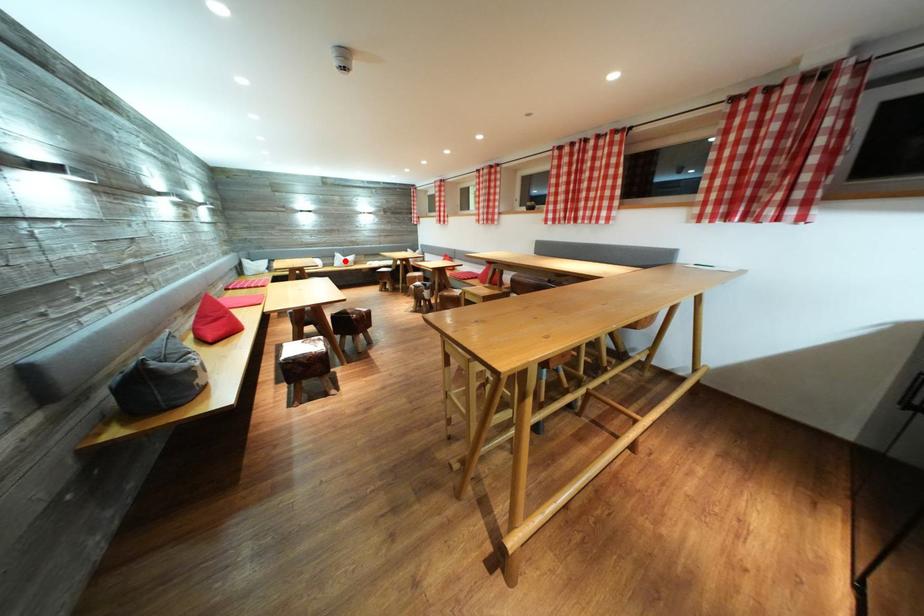
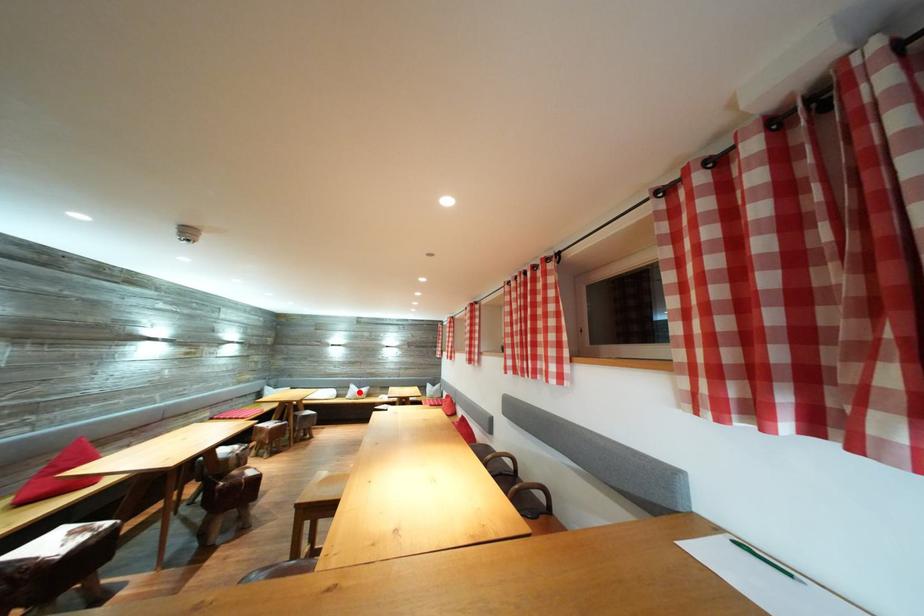
I am providing you with two images of the same scene from different viewpoints. A red point is marked on the first image and another point is marked on the second image. Is the marked point in image1 the same physical position as the marked point in image2?

Yes